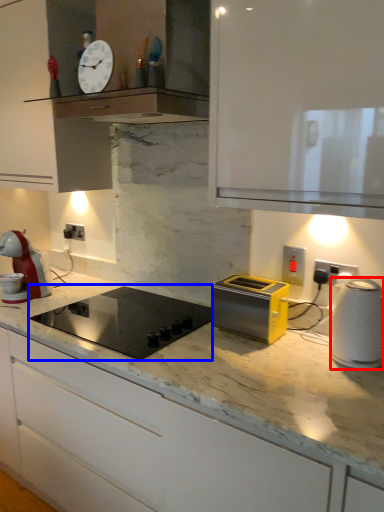
Question: Which object appears farthest to the camera in this image, kitchen appliance (highlighted by a red box) or home appliance (highlighted by a blue box)?

Choices:
 (A) kitchen appliance
 (B) home appliance

Answer: (B)